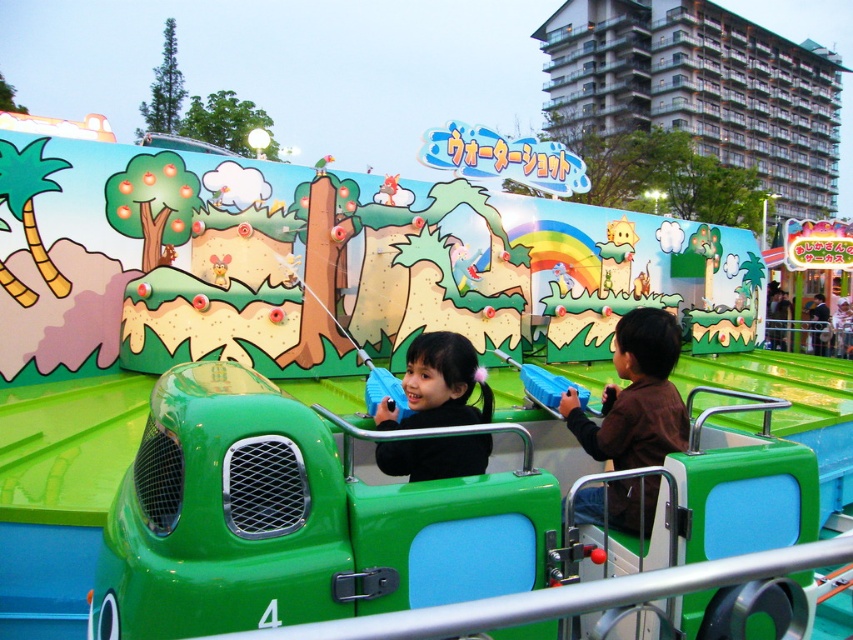
You are a photographer trying to capture the brown matte jacket at center in a photo. The camera you are using has a focus point at coordinates 0.620, 0.747. Will the jacket be in focus?

Yes, the brown matte jacket at center is positioned exactly at point [636,396], so it will be in focus.

You are a parent trying to choose between two jackets for your child at a store. The jackets are the brown matte jacket at center and the black matte jacket at center. The store has a rule that jackets must be placed at least 24 inches apart for easy access. Do these jackets meet the store requirement?

The brown matte jacket at center and the black matte jacket at center are 22.21 inches apart, which is less than the required 24 inches. Therefore, they do not meet the store requirement.